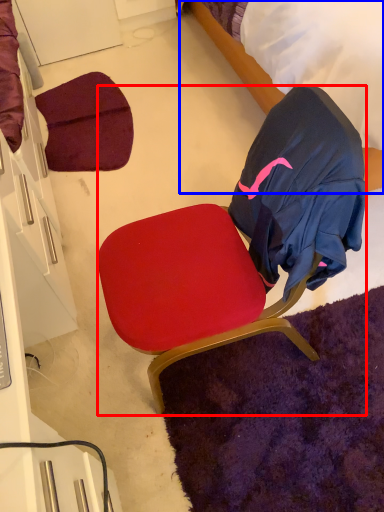
Question: Which of the following is the farthest to the observer, chair (highlighted by a red box) or bed (highlighted by a blue box)?

Choices:
 (A) chair
 (B) bed

Answer: (B)